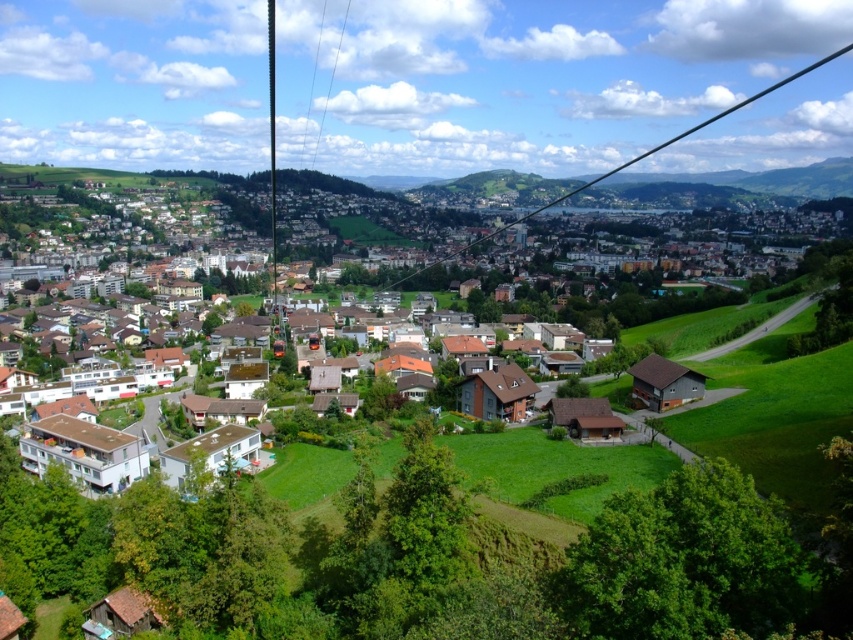
Does brown wooden houses at center appear under black wire at center?

Correct, brown wooden houses at center is located below black wire at center.

Describe the element at coordinates (775, 413) in the screenshot. I see `brown wooden houses at center` at that location.

The height and width of the screenshot is (640, 853). Find the location of `brown wooden houses at center`. brown wooden houses at center is located at coordinates (775, 413).